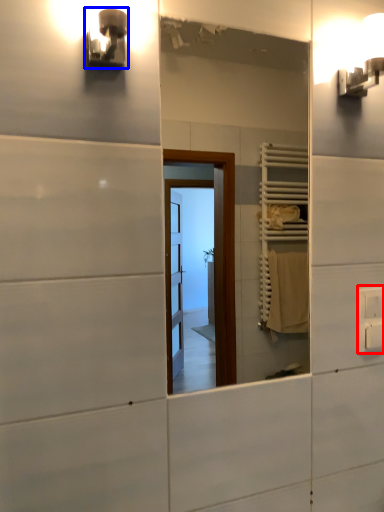
Question: Which point is closer to the camera, electric outlet (highlighted by a red box) or light fixture (highlighted by a blue box)?

Choices:
 (A) electric outlet
 (B) light fixture

Answer: (B)